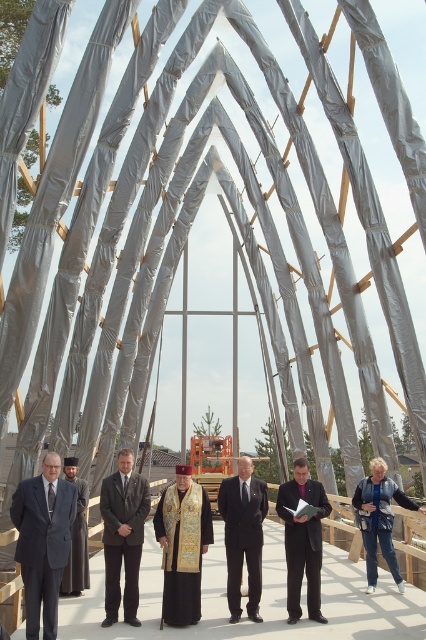
You are a photographer standing at point [123,536]. You need to take a photo of the dark gray suit at center. Where should you aim your camera?

You should aim your camera at the dark gray suit at center located at point [123,536].

You are part of the group standing under the silver fabric structure. You need to pass between the dark gray suit at left and the gray wool coat at left to reach the exit. Can you walk through the space between them?

The dark gray suit at left is to the left of the gray wool coat at left, so there is space between them for you to walk through.